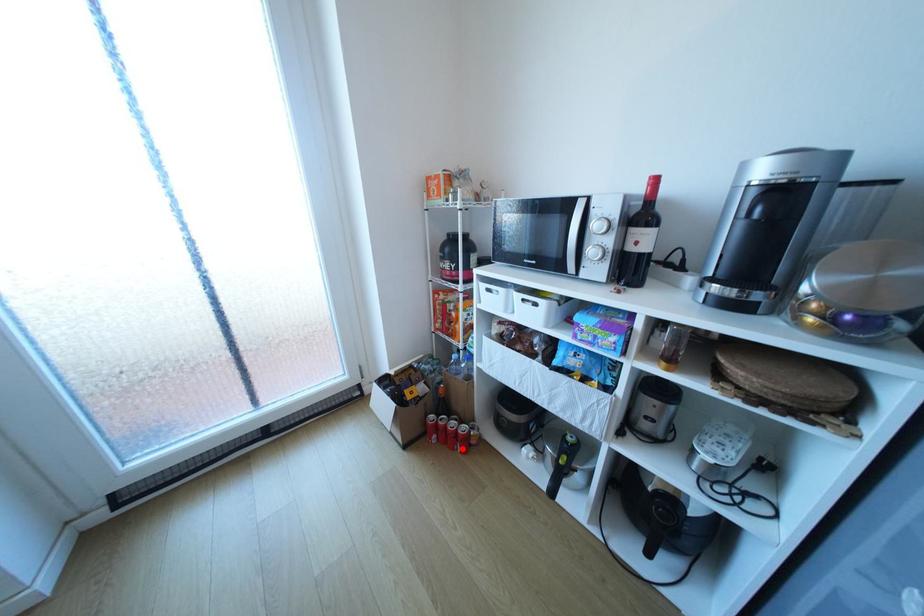
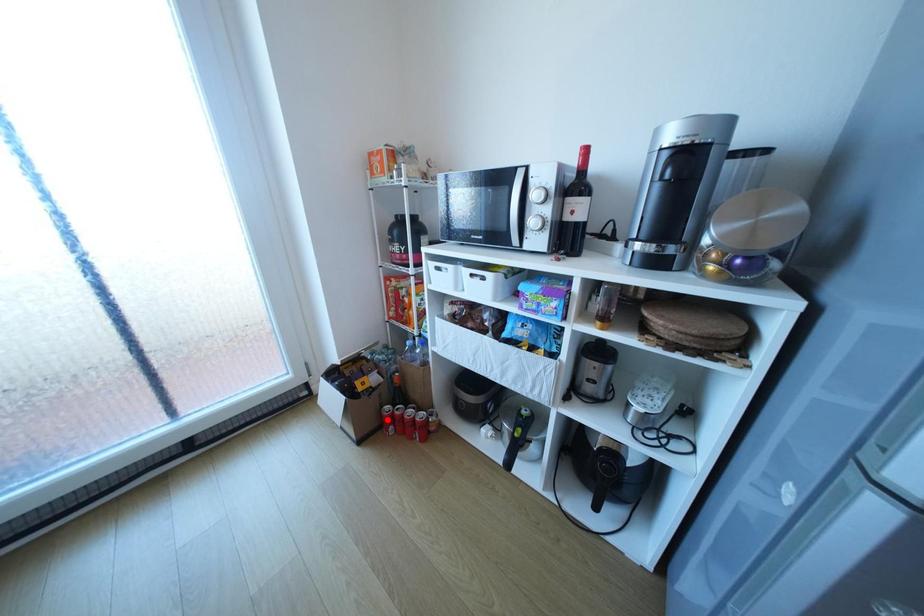
I am providing you with two images of the same scene from different viewpoints. A red point is marked on the first image and another point is marked on the second image. Does the point marked in image1 correspond to the same location as the one in image2?

No